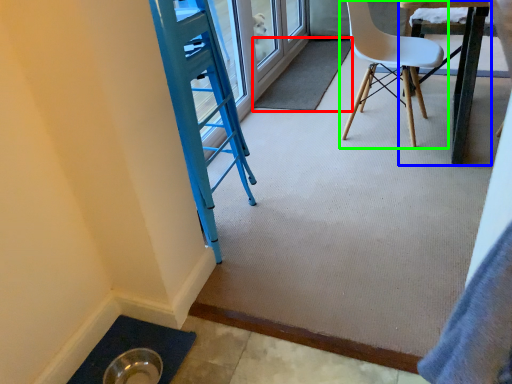
Question: Estimate the real-world distances between objects in this image. Which object is farther from mat (highlighted by a red box), table (highlighted by a blue box) or chair (highlighted by a green box)?

Choices:
 (A) table
 (B) chair

Answer: (A)